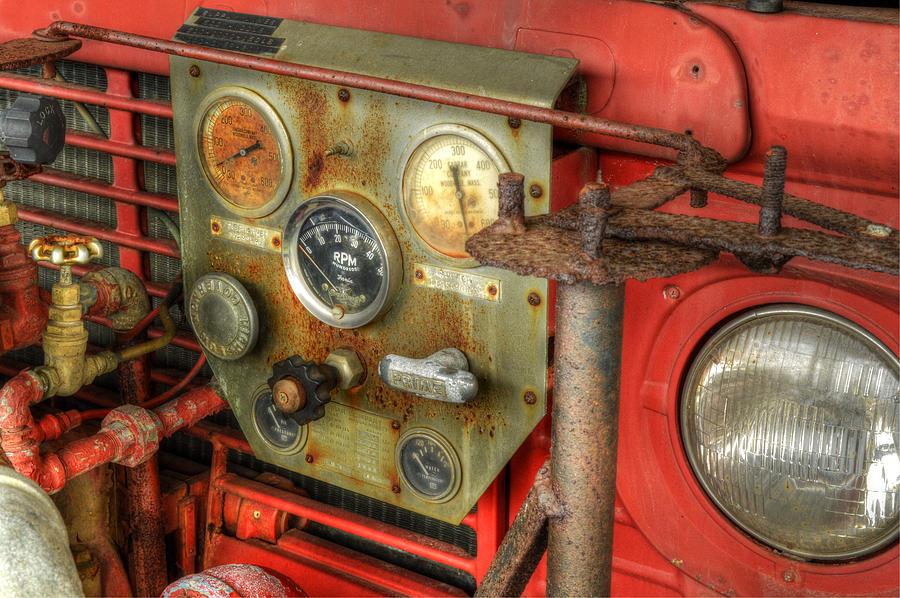
Find the location of a particular element. The height and width of the screenshot is (598, 900). cord is located at coordinates (187, 377).